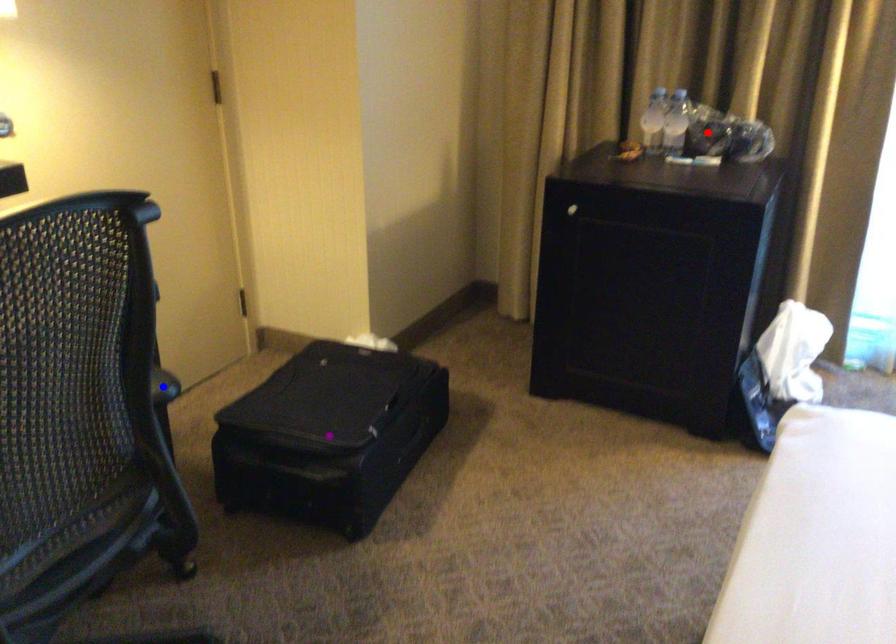
Order these from nearest to farthest:
red point, blue point, purple point

blue point → red point → purple point